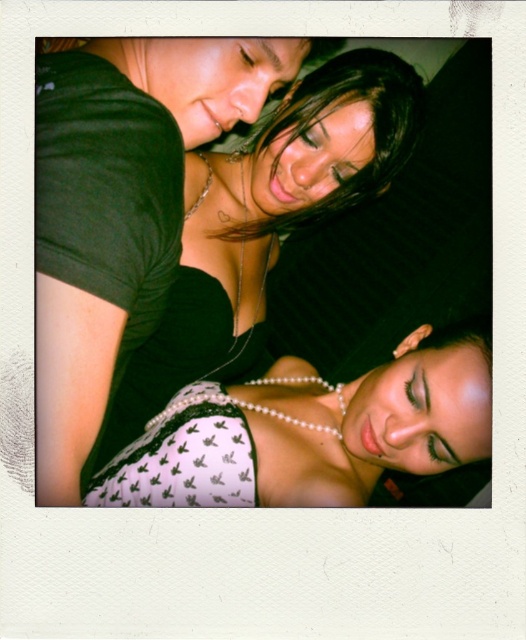
Question: Estimate the real-world distances between objects in this image. Which object is farther from the white lace bra at upper center?

Choices:
 (A) white lace top at lower center
 (B) shiny black hair at upper center

Answer: (A)

Question: Can you confirm if white lace top at lower center is positioned below shiny black hair at upper center?

Choices:
 (A) yes
 (B) no

Answer: (A)

Question: Is white lace top at lower center to the right of white lace bra at upper center from the viewer's perspective?

Choices:
 (A) no
 (B) yes

Answer: (B)

Question: Which point is closer to the camera?

Choices:
 (A) white lace bra at upper center
 (B) shiny black hair at upper center

Answer: (A)

Question: Does white lace top at lower center come in front of white lace bra at upper center?

Choices:
 (A) no
 (B) yes

Answer: (B)

Question: Considering the real-world distances, which object is closest to the white lace top at lower center?

Choices:
 (A) white lace bra at upper center
 (B) shiny black hair at upper center

Answer: (A)